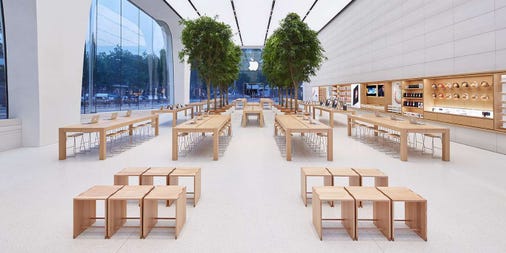
At what (x,y) coordinates should I click in order to perform the action: click on tables. Please return your answer as a coordinate pair (x, y). Image resolution: width=506 pixels, height=253 pixels. Looking at the image, I should click on (198, 130).